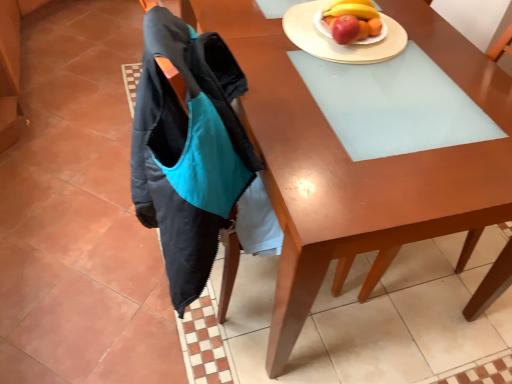
Locate an element on the screen. vacant area to the right of wooden plate at upper right, the second plate when ordered from right to left is located at coordinates (444, 50).